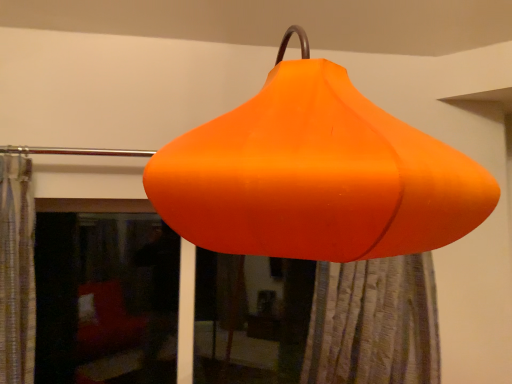
Question: From a real-world perspective, relative to orange fabric shower curtain at lower center, is transparent glass window at lower left vertically above or below?

Choices:
 (A) above
 (B) below

Answer: (A)

Question: In the image, is transparent glass window at lower left positioned in front of or behind orange fabric shower curtain at lower center?

Choices:
 (A) front
 (B) behind

Answer: (B)

Question: Estimate the real-world distances between objects in this image. Which object is closer to the transparent glass window at lower left?

Choices:
 (A) orange fabric shower curtain at lower center
 (B) orange matte lampshade at center

Answer: (A)

Question: Which of these objects is positioned closest to the orange fabric shower curtain at lower center?

Choices:
 (A) transparent glass window at lower left
 (B) orange matte lampshade at center

Answer: (B)